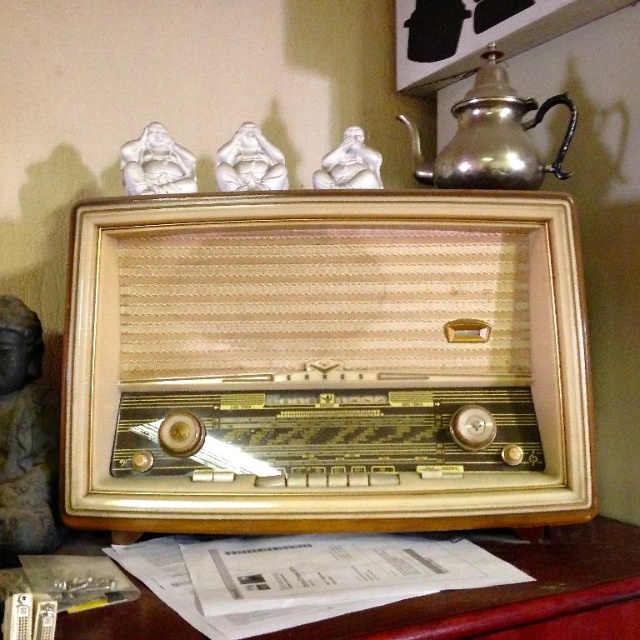
Question: Which point is closer to the camera taking this photo?

Choices:
 (A) [x=566, y=108]
 (B) [x=176, y=150]
 (C) [x=244, y=170]
 (D) [x=348, y=180]

Answer: (C)

Question: Can you confirm if brown wooden table at lower center is positioned below gray stone statue at left?

Choices:
 (A) no
 (B) yes

Answer: (B)

Question: Which is farther from the shiny metallic teapot at upper right?

Choices:
 (A) white glossy statue at upper center
 (B) gray stone statue at left
 (C) brown wooden table at lower center

Answer: (B)

Question: Which of the following is the farthest from the observer?

Choices:
 (A) (572, 634)
 (B) (276, 156)
 (C) (24, 346)

Answer: (B)

Question: Can you confirm if white glossy figurine at upper center is positioned above white glossy statue at center?

Choices:
 (A) yes
 (B) no

Answer: (B)

Question: Is white glossy figurine at upper center to the right of white glossy statue at upper center from the viewer's perspective?

Choices:
 (A) yes
 (B) no

Answer: (B)